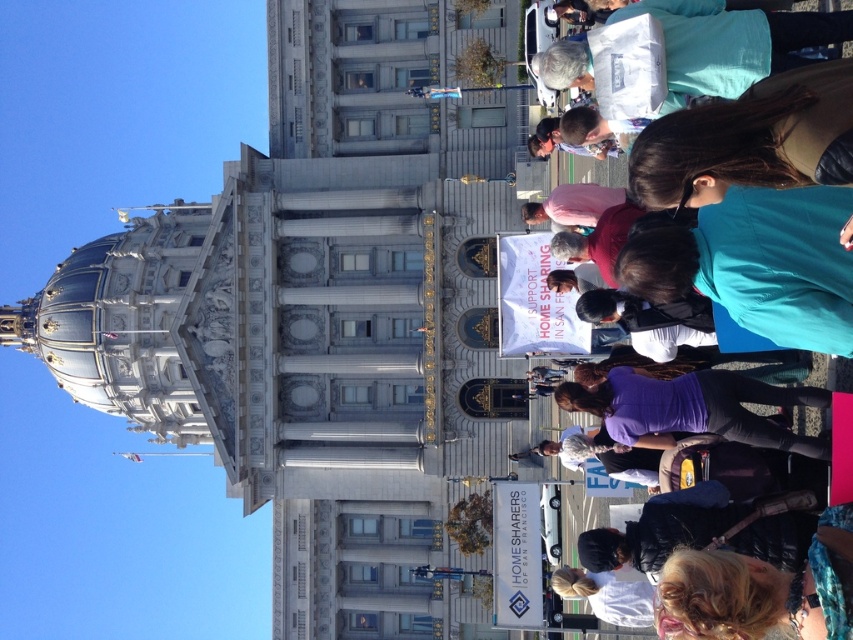
You are a photographer trying to capture both the white marble tower at center and the purple fabric at center in a single frame. Based on their sizes, which object should you focus on to ensure both fit in the frame?

The white marble tower at center might be wider than purple fabric at center, so focusing on the wider object would help ensure both fit in the frame.

You are a photographer standing in front of the grand neoclassical building. You want to take a photo that includes both the teal fabric crowd at right and the blue fabric sign at upper center. Which object should you adjust your camera angle to focus on first to ensure both are in frame?

The teal fabric crowd at right is below the blue fabric sign at upper center. To include both in the frame, adjust your camera angle to focus on the blue fabric sign at upper center first, then ensure the teal fabric crowd at right is visible below it.